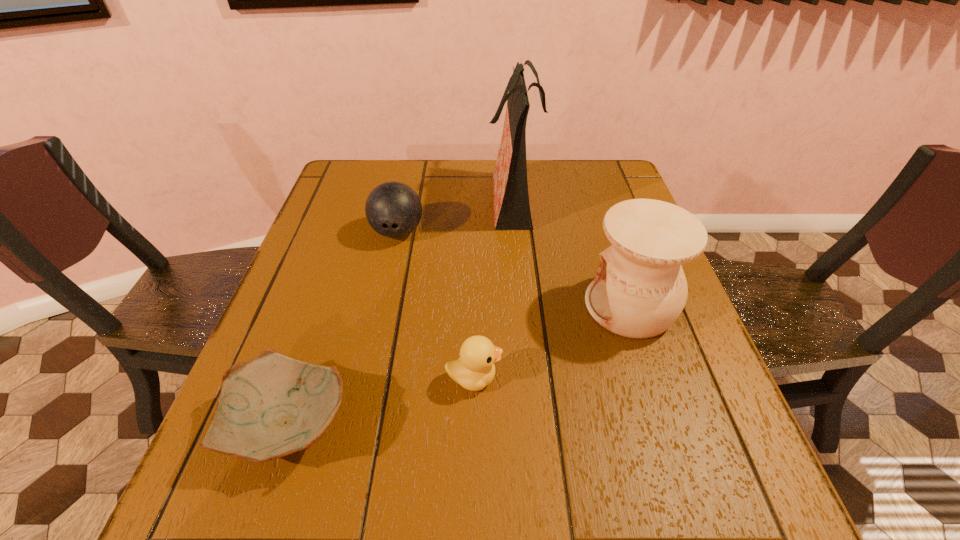
Image resolution: width=960 pixels, height=540 pixels. Identify the location of free spot between the taller pottery and the second shortest object. (552, 342).

You are a GUI agent. You are given a task and a screenshot of the screen. Output one action in this format:
    pyautogui.click(x=<x>, y=<y>)
    Task: Click on the free spot between the rightmost object and the duck
    
    Given the screenshot: What is the action you would take?
    pyautogui.click(x=552, y=342)

Where is `free area in between the duck and the bowling ball`? The height and width of the screenshot is (540, 960). free area in between the duck and the bowling ball is located at coordinates (436, 305).

Image resolution: width=960 pixels, height=540 pixels. I want to click on free space between the shopping bag and the nearer pottery, so click(x=402, y=310).

At what (x,y) coordinates should I click in order to perform the action: click on free space between the second shortest object and the tallest object. Please return your answer as a coordinate pair (x, y). Looking at the image, I should click on (493, 287).

Locate an element on the screen. Image resolution: width=960 pixels, height=540 pixels. object that is the fourth closest to the taller pottery is located at coordinates (271, 406).

Where is `the third closest object relative to the second shortest object`? The image size is (960, 540). the third closest object relative to the second shortest object is located at coordinates (393, 209).